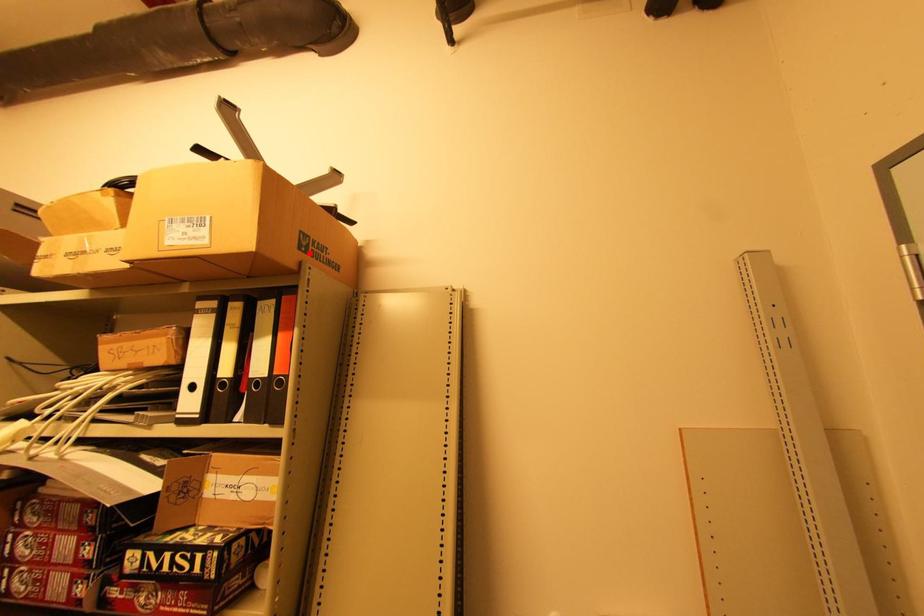
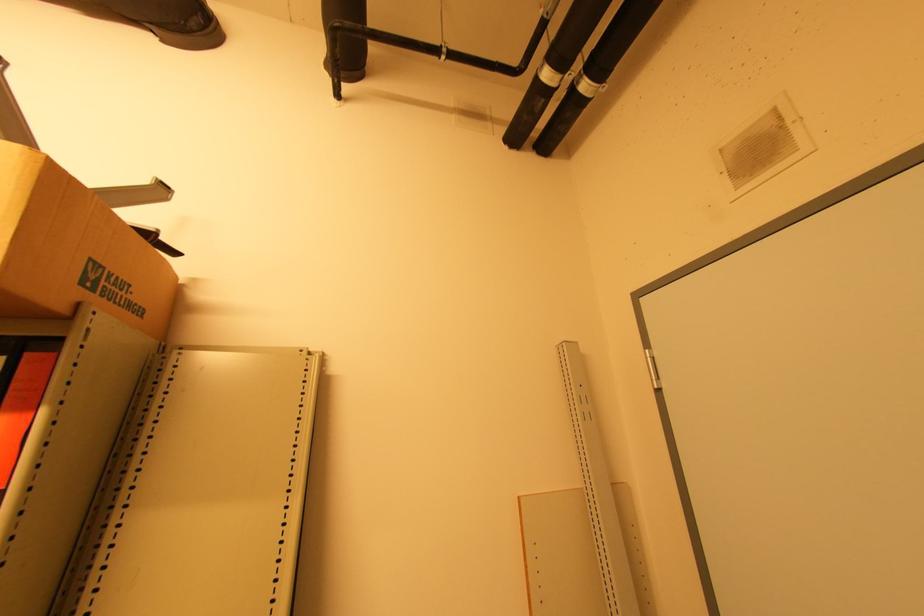
Where in the second image is the point corresponding to the highlighted location from the first image?

(95, 290)